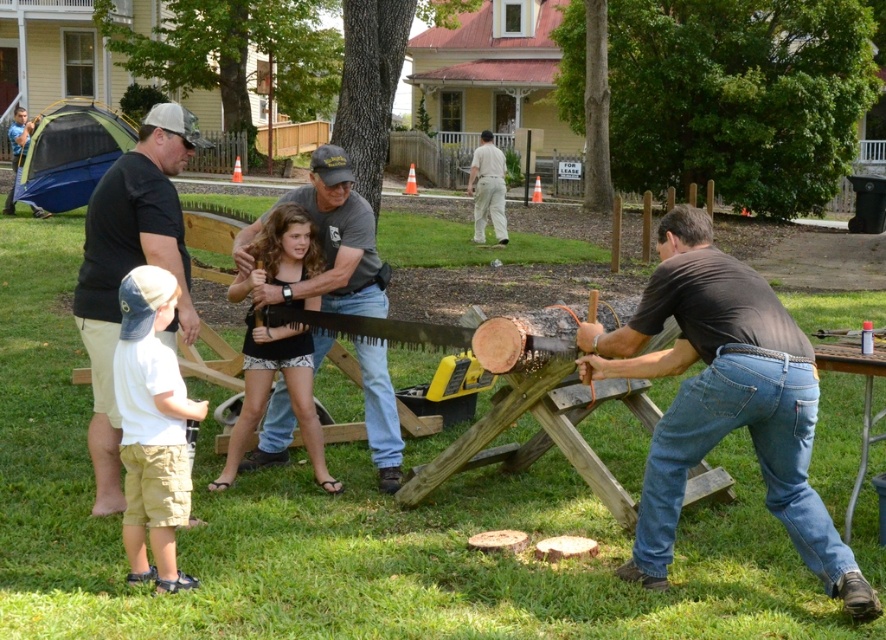
Question: Estimate the real-world distances between objects in this image. Which object is closer to the black cotton t-shirt at left?

Choices:
 (A) brown cotton shirt at right
 (B) black fabric dress at center

Answer: (B)

Question: Which point is closer to the camera?

Choices:
 (A) wooden sawhorse at center
 (B) wooden picnic table at lower right

Answer: (A)

Question: Which of the following is the farthest from the observer?

Choices:
 (A) brown cotton shirt at right
 (B) black fabric dress at center
 (C) white cotton shirt at lower left

Answer: (B)

Question: In this image, where is brown cotton shirt at right located relative to light beige pants at center?

Choices:
 (A) above
 (B) below

Answer: (B)

Question: Can you confirm if black fabric dress at center is wider than light beige pants at center?

Choices:
 (A) no
 (B) yes

Answer: (B)

Question: Does black cotton t-shirt at left appear under light beige pants at center?

Choices:
 (A) no
 (B) yes

Answer: (B)